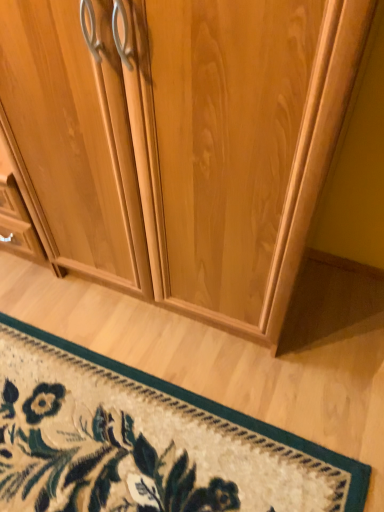
Describe the element at coordinates (145, 442) in the screenshot. This screenshot has width=384, height=512. I see `floral carpet at lower left` at that location.

Where is `floral carpet at lower left`? Image resolution: width=384 pixels, height=512 pixels. floral carpet at lower left is located at coordinates (145, 442).

Find the location of a particular element. This screenshot has height=512, width=384. floral carpet at lower left is located at coordinates (145, 442).